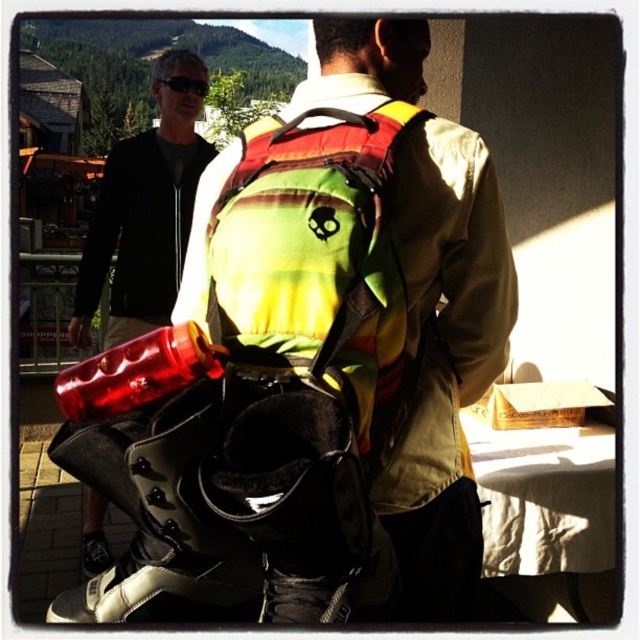
Question: Which object is farther from the camera taking this photo?

Choices:
 (A) rasta-colored fabric safety vest at back
 (B) black plastic goggles at upper center

Answer: (B)

Question: Is rasta-colored fabric safety vest at back bigger than black plastic goggles at upper center?

Choices:
 (A) no
 (B) yes

Answer: (B)

Question: Which point is closer to the camera?

Choices:
 (A) rasta-colored fabric safety vest at back
 (B) black plastic goggles at upper center

Answer: (A)

Question: Estimate the real-world distances between objects in this image. Which object is farther from the brushed metal water bottle at left?

Choices:
 (A) rasta-patterned backpack at center
 (B) black plastic goggles at upper center
 (C) rasta-colored fabric safety vest at back

Answer: (C)

Question: Is rasta-patterned backpack at center positioned in front of brushed metal water bottle at left?

Choices:
 (A) no
 (B) yes

Answer: (B)

Question: Is rasta-colored fabric safety vest at back above brushed metal water bottle at left?

Choices:
 (A) no
 (B) yes

Answer: (A)